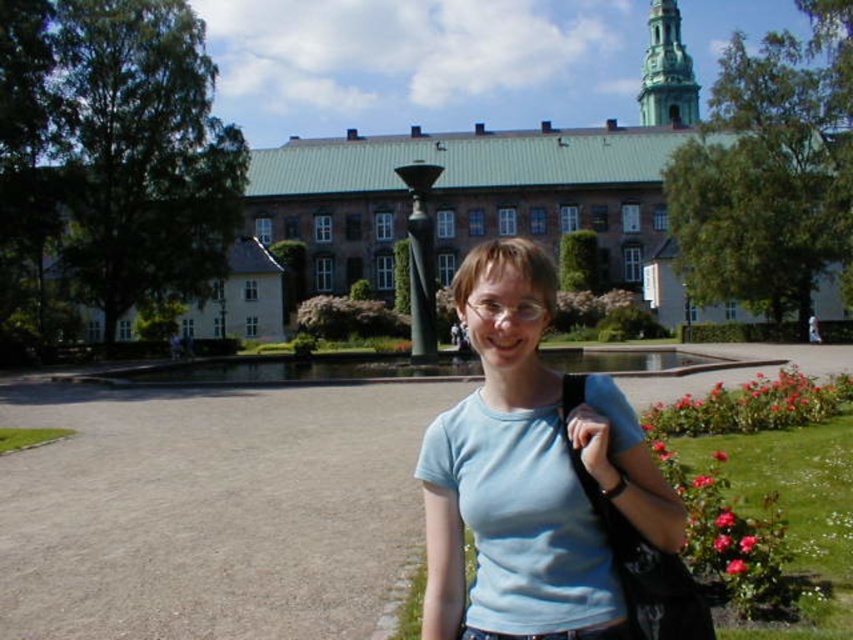
Question: Does light blue cotton t-shirt at center appear on the right side of green stone spire at upper center?

Choices:
 (A) yes
 (B) no

Answer: (B)

Question: Can you confirm if light blue cotton t-shirt at center is positioned to the left of green stone spire at upper center?

Choices:
 (A) yes
 (B) no

Answer: (A)

Question: Among these points, which one is nearest to the camera?

Choices:
 (A) (531, 372)
 (B) (648, 100)

Answer: (A)

Question: Does light blue cotton t-shirt at center have a greater width compared to green stone spire at upper center?

Choices:
 (A) yes
 (B) no

Answer: (B)

Question: Among these points, which one is farthest from the camera?

Choices:
 (A) (659, 1)
 (B) (541, 563)

Answer: (A)